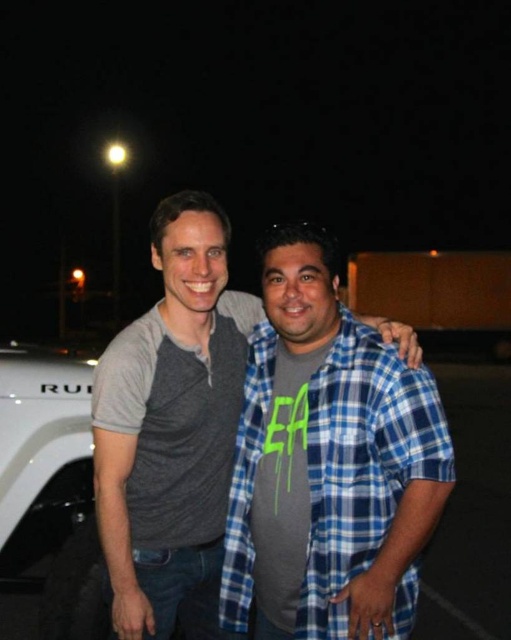
Between point (419, 408) and point (376, 292), which one is positioned behind?

The point (376, 292) is more distant.

Where is `blue plaid shirt at center`? This screenshot has height=640, width=511. blue plaid shirt at center is located at coordinates (361, 464).

Measure the distance between blue plaid shirt at center and white matte vehicle at left.

They are 1.30 meters apart.

Which is more to the left, blue plaid shirt at center or white matte vehicle at left?

white matte vehicle at left is more to the left.

Does point (369, 451) come closer to viewer compared to point (73, 444)?

Yes, it is.

Locate an element on the screen. This screenshot has width=511, height=640. blue plaid shirt at center is located at coordinates (361, 464).

Can you confirm if gray cotton shirt at center is thinner than brown matte pickup truck at center?

Correct, gray cotton shirt at center's width is less than brown matte pickup truck at center's.

At what (x,y) coordinates should I click in order to perform the action: click on gray cotton shirt at center. Please return your answer as a coordinate pair (x, y). The width and height of the screenshot is (511, 640). Looking at the image, I should click on (171, 428).

I want to click on gray cotton shirt at center, so click(x=171, y=428).